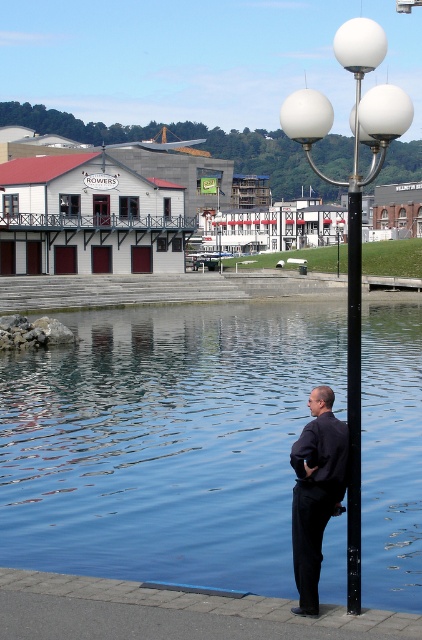
What do you see at coordinates (165, 442) in the screenshot?
I see `blue smooth water at center` at bounding box center [165, 442].

Image resolution: width=422 pixels, height=640 pixels. What do you see at coordinates (165, 442) in the screenshot? I see `blue smooth water at center` at bounding box center [165, 442].

In order to click on blue smooth water at center in this screenshot , I will do `click(165, 442)`.

Between white glossy lamp post at upper center and black smooth shirt at center, which one has less height?

black smooth shirt at center

Is white glossy lamp post at upper center above black smooth shirt at center?

Yes.

Identify the location of white glossy lamp post at upper center. This screenshot has height=640, width=422. (352, 221).

Which is below, blue smooth water at center or white glossy streetlight at right?

→ Positioned lower is blue smooth water at center.

Between blue smooth water at center and white glossy streetlight at right, which one appears on the left side from the viewer's perspective?

From the viewer's perspective, blue smooth water at center appears more on the left side.

Locate an element on the screen. The width and height of the screenshot is (422, 640). blue smooth water at center is located at coordinates (165, 442).

This screenshot has height=640, width=422. I want to click on blue smooth water at center, so click(165, 442).